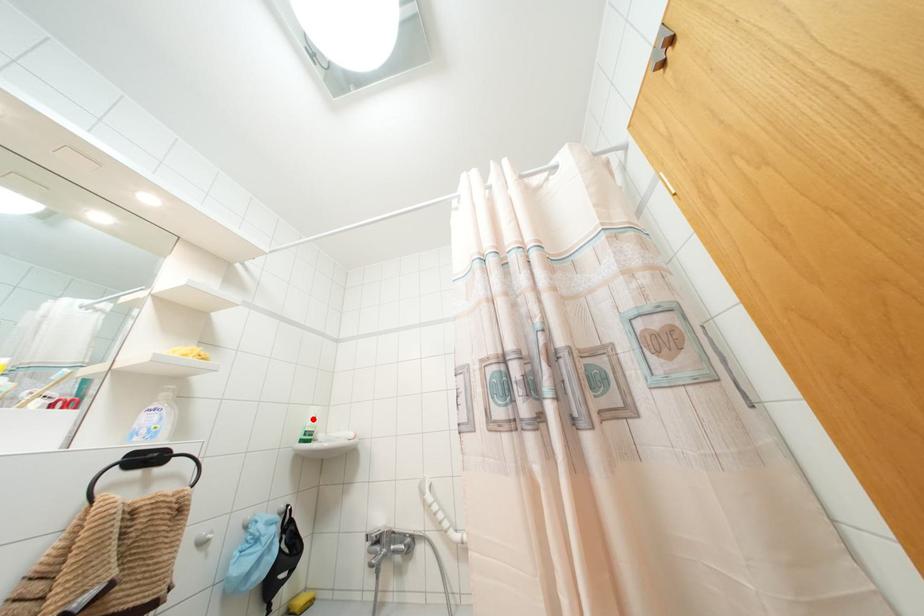
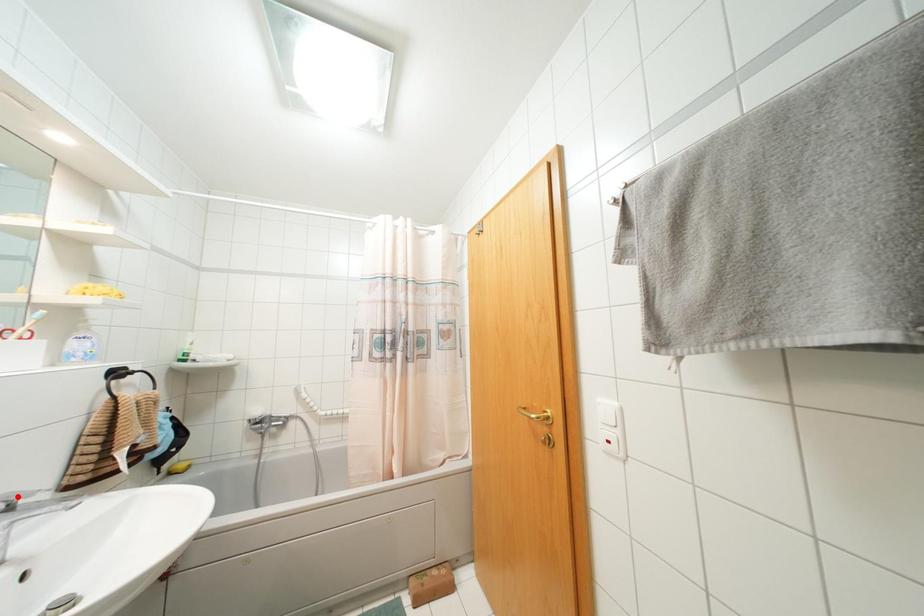
I am providing you with two images of the same scene from different viewpoints. A red point is marked on the first image and another point is marked on the second image. Is the red point in image1 aligned with the point shown in image2?

No